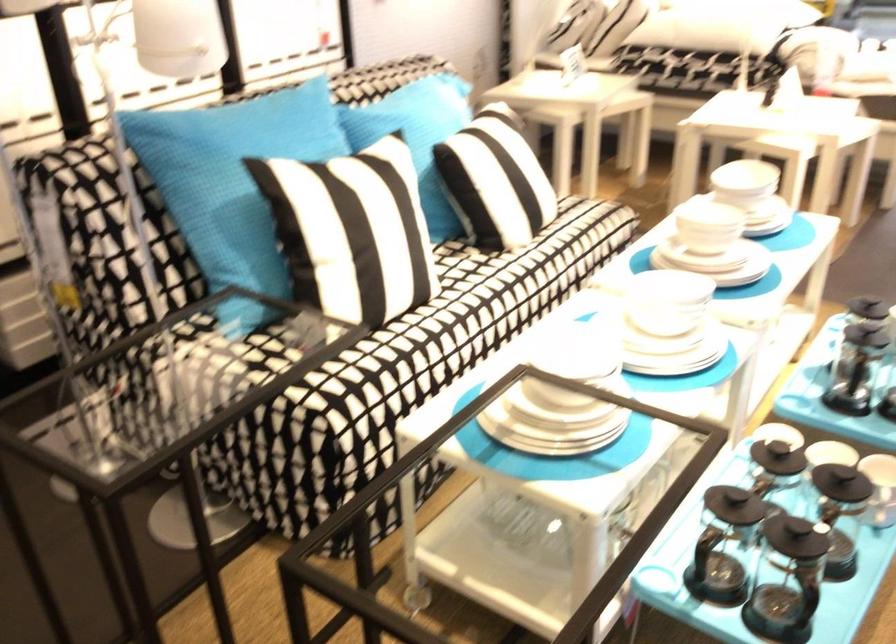
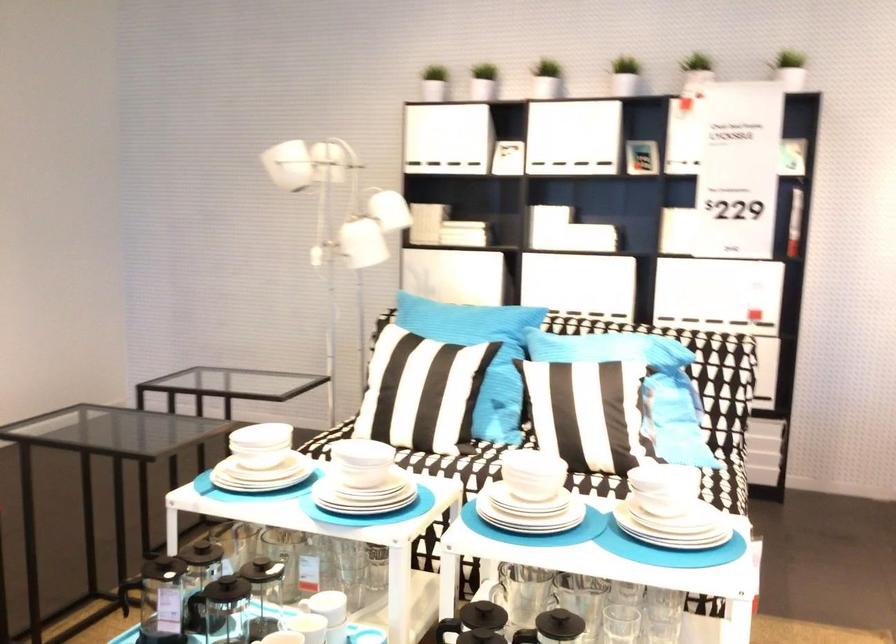
In the second image, find the point that corresponds to point 461,105 in the first image.

(615, 345)